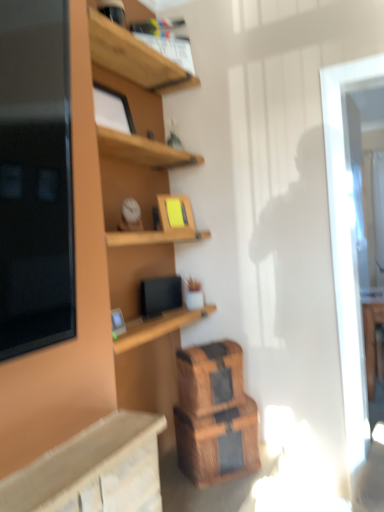
In order to face transparent glass door at right, should I rotate leftwards or rightwards?

Rotate your view right by about 20.103°.

The image size is (384, 512). What do you see at coordinates (347, 246) in the screenshot?
I see `transparent glass door at right` at bounding box center [347, 246].

Locate an element on the screen. The width and height of the screenshot is (384, 512). wooden crate at lower center, acting as the 2th crate starting from the top is located at coordinates (217, 443).

This screenshot has width=384, height=512. Find the location of `transparent glass door at right`. transparent glass door at right is located at coordinates (347, 246).

From a real-world perspective, does wooden crate at lower center, acting as the 2th crate starting from the top, sit lower than wooden shelf at upper center?

Yes, from a real-world perspective, wooden crate at lower center, acting as the 2th crate starting from the top, is below wooden shelf at upper center.

From the image's perspective, would you say wooden crate at lower center, positioned as the 1th crate in bottom-to-top order, is positioned over wooden shelf at upper center?

A: No, from the image's perspective, wooden crate at lower center, positioned as the 1th crate in bottom-to-top order, is not above wooden shelf at upper center.

Is wooden crate at lower center, positioned as the 1th crate in bottom-to-top order, bigger or smaller than wooden shelf at upper center?

In the image, wooden crate at lower center, positioned as the 1th crate in bottom-to-top order, appears to be larger than wooden shelf at upper center.

What's the angular difference between wooden crate at lower center, positioned as the 1th crate in bottom-to-top order, and wooden shelf at upper center's facing directions?

The angular difference between wooden crate at lower center, positioned as the 1th crate in bottom-to-top order, and wooden shelf at upper center is 0.206 degrees.

Which object is wider, wooden shelf at upper center or transparent glass door at right?

Wider between the two is transparent glass door at right.

In the image, there is a wooden shelf at upper center. At what (x,y) coordinates should I click in order to perform the action: click on glass door below it (from a real-world perspective). Please return your answer as a coordinate pair (x, y). The width and height of the screenshot is (384, 512). Looking at the image, I should click on (347, 246).

Is wooden shelf at upper center taller than transparent glass door at right?

In fact, wooden shelf at upper center may be shorter than transparent glass door at right.

From the image's perspective, is wooden shelf at upper center over transparent glass door at right?

Yes.

Is wooden crate at lower center, acting as the 2th crate starting from the top, wider or thinner than wooden crate at lower center, the 1th crate positioned from the top?

Considering their sizes, wooden crate at lower center, acting as the 2th crate starting from the top, looks broader than wooden crate at lower center, the 1th crate positioned from the top.

Is wooden crate at lower center, acting as the 2th crate starting from the top, directly adjacent to wooden crate at lower center, the second crate from the bottom?

They are not placed beside each other.

Which of these two, wooden crate at lower center, acting as the 2th crate starting from the top, or wooden crate at lower center, the 1th crate positioned from the top, is bigger?

wooden crate at lower center, acting as the 2th crate starting from the top, is bigger.

Where is `crate below the wooden crate at lower center, the 1th crate positioned from the top (from the image's perspective)`? The height and width of the screenshot is (512, 384). crate below the wooden crate at lower center, the 1th crate positioned from the top (from the image's perspective) is located at coordinates (217, 443).

Looking at this image, considering the relative sizes of wooden crate at lower center, the 1th crate positioned from the top, and wooden shelf at upper center in the image provided, is wooden crate at lower center, the 1th crate positioned from the top, thinner than wooden shelf at upper center?

In fact, wooden crate at lower center, the 1th crate positioned from the top, might be wider than wooden shelf at upper center.

Is wooden crate at lower center, the second crate from the bottom, taller than wooden shelf at upper center?

No.

Based on the photo, visually, is wooden crate at lower center, the 1th crate positioned from the top, positioned to the left or to the right of wooden shelf at upper center?

wooden crate at lower center, the 1th crate positioned from the top, is positioned on wooden shelf at upper center's right side.

Is wooden shelf at upper center at the back of wooden crate at lower center, the 1th crate positioned from the top?

That's not correct — wooden crate at lower center, the 1th crate positioned from the top, is not looking away from wooden shelf at upper center.

Does wooden shelf at upper center lie in front of wooden crate at lower center, the 1th crate positioned from the top?

No, the depth of wooden shelf at upper center is greater than that of wooden crate at lower center, the 1th crate positioned from the top.

From the image's perspective, is wooden shelf at upper center below wooden crate at lower center, the second crate from the bottom?

Actually, wooden shelf at upper center appears above wooden crate at lower center, the second crate from the bottom, in the image.

Between wooden shelf at upper center and wooden crate at lower center, the 1th crate positioned from the top, which one has larger width?

Wider between the two is wooden crate at lower center, the 1th crate positioned from the top.

In terms of size, does wooden shelf at upper center appear bigger or smaller than wooden crate at lower center, the 1th crate positioned from the top?

Considering their sizes, wooden shelf at upper center takes up less space than wooden crate at lower center, the 1th crate positioned from the top.

In the scene shown: Considering their positions, is wooden crate at lower center, the second crate from the bottom, located in front of or behind wooden crate at lower center, positioned as the 1th crate in bottom-to-top order?

Visually, wooden crate at lower center, the second crate from the bottom, is located behind wooden crate at lower center, positioned as the 1th crate in bottom-to-top order.

How different are the orientations of wooden crate at lower center, the second crate from the bottom, and wooden crate at lower center, acting as the 2th crate starting from the top, in degrees?

The angular difference between wooden crate at lower center, the second crate from the bottom, and wooden crate at lower center, acting as the 2th crate starting from the top, is 4.59 degrees.

In the image, there is a wooden crate at lower center, acting as the 2th crate starting from the top. At what (x,y) coordinates should I click in order to perform the action: click on crate above it (from the image's perspective). Please return your answer as a coordinate pair (x, y). Looking at the image, I should click on (210, 377).

Are wooden crate at lower center, the second crate from the bottom, and wooden crate at lower center, positioned as the 1th crate in bottom-to-top order, located far from each other?

wooden crate at lower center, the second crate from the bottom, is actually quite close to wooden crate at lower center, positioned as the 1th crate in bottom-to-top order.

Is wooden crate at lower center, positioned as the 1th crate in bottom-to-top order, in front of or behind transparent glass door at right in the image?

Visually, wooden crate at lower center, positioned as the 1th crate in bottom-to-top order, is located in front of transparent glass door at right.

Based on the photo, is transparent glass door at right at the back of wooden crate at lower center, positioned as the 1th crate in bottom-to-top order?

wooden crate at lower center, positioned as the 1th crate in bottom-to-top order, does not have its back to transparent glass door at right.

Considering the sizes of objects wooden crate at lower center, acting as the 2th crate starting from the top, and transparent glass door at right in the image provided, who is wider, wooden crate at lower center, acting as the 2th crate starting from the top, or transparent glass door at right?

Wider between the two is wooden crate at lower center, acting as the 2th crate starting from the top.

At what (x,y) coordinates should I click in order to perform the action: click on shelf above the wooden crate at lower center, acting as the 2th crate starting from the top (from a real-world perspective). Please return your answer as a coordinate pair (x, y). The width and height of the screenshot is (384, 512). Looking at the image, I should click on (128, 54).

The image size is (384, 512). In the image, there is a transparent glass door at right. In order to click on shelf above it (from the image's perspective) in this screenshot , I will do click(128, 54).

Based on their spatial positions, is wooden crate at lower center, the second crate from the bottom, or wooden crate at lower center, positioned as the 1th crate in bottom-to-top order, further from transparent glass door at right?

wooden crate at lower center, the second crate from the bottom.

Looking at the image, which one is located closer to wooden crate at lower center, the second crate from the bottom, wooden crate at lower center, acting as the 2th crate starting from the top, or wooden shelf at upper center?

wooden crate at lower center, acting as the 2th crate starting from the top.

Looking at the image, which one is located closer to wooden crate at lower center, acting as the 2th crate starting from the top, transparent glass door at right or wooden crate at lower center, the 1th crate positioned from the top?

The object closer to wooden crate at lower center, acting as the 2th crate starting from the top, is wooden crate at lower center, the 1th crate positioned from the top.

Considering their positions, is transparent glass door at right positioned further to wooden crate at lower center, the second crate from the bottom, than wooden crate at lower center, acting as the 2th crate starting from the top?

transparent glass door at right.

From the picture: Which object lies further to the anchor point wooden crate at lower center, the 1th crate positioned from the top, wooden shelf at upper center or transparent glass door at right?

wooden shelf at upper center is positioned further to the anchor wooden crate at lower center, the 1th crate positioned from the top.

Considering their positions, is transparent glass door at right positioned further to wooden crate at lower center, the 1th crate positioned from the top, than wooden shelf at upper center?

Based on the image, wooden shelf at upper center appears to be further to wooden crate at lower center, the 1th crate positioned from the top.

Estimate the real-world distances between objects in this image. Which object is closer to wooden crate at lower center, acting as the 2th crate starting from the top, wooden shelf at upper center or wooden crate at lower center, the second crate from the bottom?

wooden crate at lower center, the second crate from the bottom, is closer to wooden crate at lower center, acting as the 2th crate starting from the top.

When comparing their distances from wooden shelf at upper center, does wooden crate at lower center, acting as the 2th crate starting from the top, or wooden crate at lower center, the second crate from the bottom, seem closer?

Based on the image, wooden crate at lower center, the second crate from the bottom, appears to be nearer to wooden shelf at upper center.

Find the location of a particular element. glass door between wooden shelf at upper center and wooden crate at lower center, acting as the 2th crate starting from the top, in the up-down direction is located at coordinates tap(347, 246).

Where is `crate between wooden shelf at upper center and wooden crate at lower center, positioned as the 1th crate in bottom-to-top order, from top to bottom`? crate between wooden shelf at upper center and wooden crate at lower center, positioned as the 1th crate in bottom-to-top order, from top to bottom is located at coordinates (210, 377).

At what (x,y) coordinates should I click in order to perform the action: click on crate located between wooden crate at lower center, the 1th crate positioned from the top, and transparent glass door at right in the left-right direction. Please return your answer as a coordinate pair (x, y). This screenshot has height=512, width=384. Looking at the image, I should click on (217, 443).

This screenshot has width=384, height=512. I want to click on glass door between wooden shelf at upper center and wooden crate at lower center, the 1th crate positioned from the top, in the vertical direction, so click(x=347, y=246).